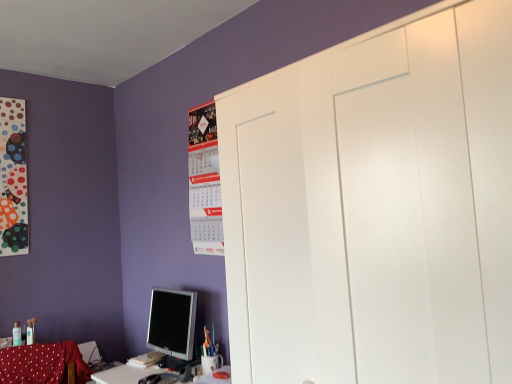
Question: From a real-world perspective, does red fabric swivel chair at lower left sit lower than matte paper calendar at upper center?

Choices:
 (A) no
 (B) yes

Answer: (B)

Question: Considering the relative sizes of red fabric swivel chair at lower left and matte paper calendar at upper center in the image provided, is red fabric swivel chair at lower left smaller than matte paper calendar at upper center?

Choices:
 (A) yes
 (B) no

Answer: (B)

Question: Can you confirm if red fabric swivel chair at lower left is taller than matte paper calendar at upper center?

Choices:
 (A) no
 (B) yes

Answer: (A)

Question: From the image's perspective, is red fabric swivel chair at lower left over matte paper calendar at upper center?

Choices:
 (A) yes
 (B) no

Answer: (B)

Question: Is red fabric swivel chair at lower left directly adjacent to matte paper calendar at upper center?

Choices:
 (A) no
 (B) yes

Answer: (A)

Question: Is red fabric swivel chair at lower left bigger than matte paper calendar at upper center?

Choices:
 (A) no
 (B) yes

Answer: (B)

Question: Is red fabric swivel chair at lower left thinner than matte silver monitor at lower left?

Choices:
 (A) yes
 (B) no

Answer: (A)

Question: Does red fabric swivel chair at lower left appear on the left side of matte silver monitor at lower left?

Choices:
 (A) yes
 (B) no

Answer: (A)

Question: Does red fabric swivel chair at lower left have a lesser height compared to matte silver monitor at lower left?

Choices:
 (A) no
 (B) yes

Answer: (B)

Question: From the image's perspective, is red fabric swivel chair at lower left located above matte silver monitor at lower left?

Choices:
 (A) yes
 (B) no

Answer: (B)

Question: Is red fabric swivel chair at lower left located outside matte silver monitor at lower left?

Choices:
 (A) no
 (B) yes

Answer: (B)

Question: From a real-world perspective, is red fabric swivel chair at lower left below matte silver monitor at lower left?

Choices:
 (A) no
 (B) yes

Answer: (B)

Question: From the image's perspective, is matte silver monitor at lower left on top of red fabric swivel chair at lower left?

Choices:
 (A) no
 (B) yes

Answer: (B)